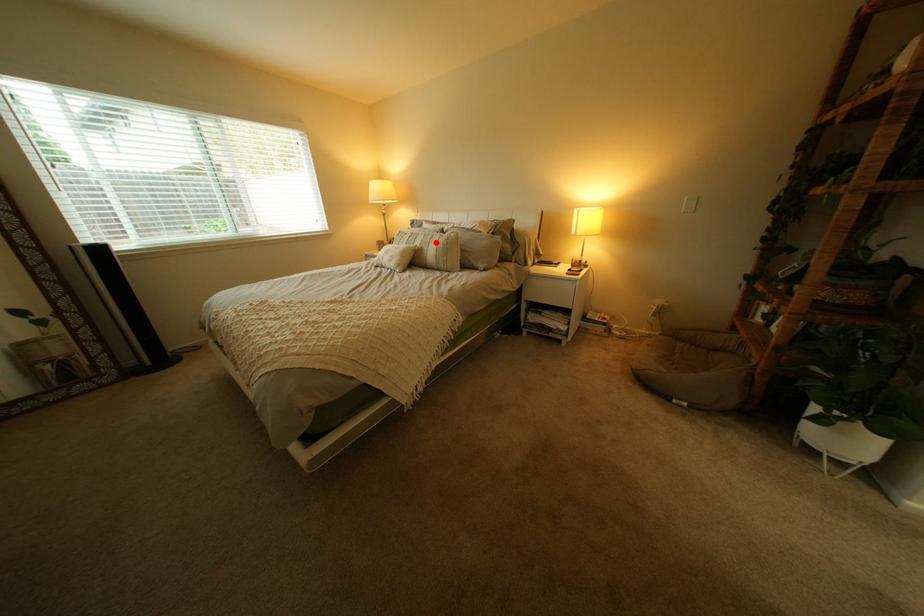
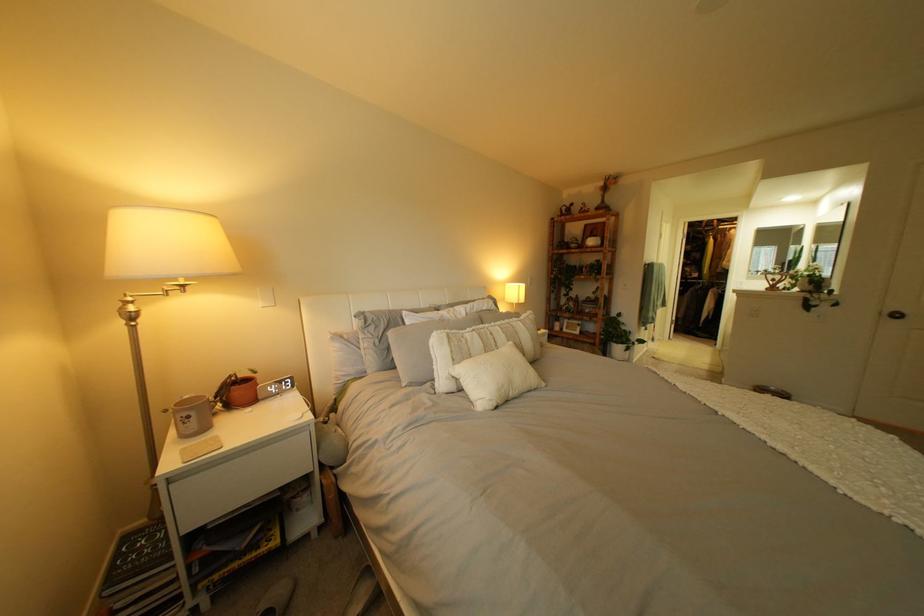
Question: I am providing you with two images of the same scene from different viewpoints. Image1 has a red point marked. In image2, the corresponding 3D location appears at what relative position? Reply with the corresponding letter.

Choices:
 (A) Closer
 (B) Farther

Answer: (B)